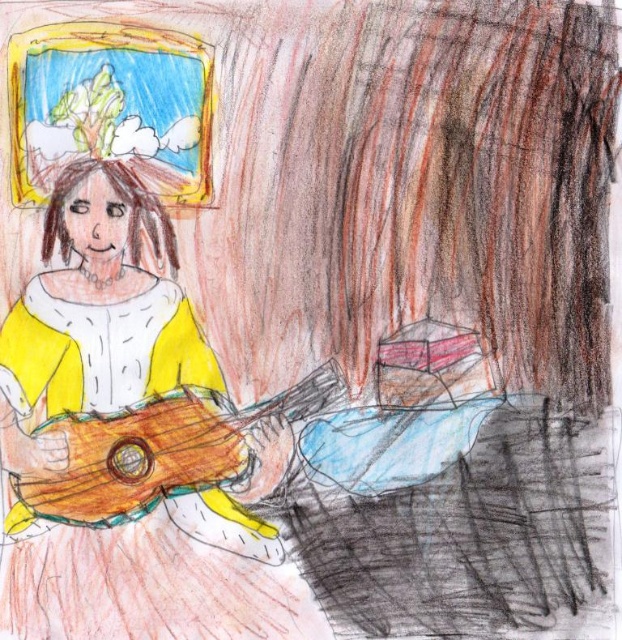
Question: Which point is farther to the camera?

Choices:
 (A) (123, 406)
 (B) (317, 371)

Answer: (B)

Question: Does matte yellow dress at left have a greater width compared to wooden guitar at lower left?

Choices:
 (A) yes
 (B) no

Answer: (B)

Question: Can you confirm if matte yellow dress at left is bigger than wooden guitar at lower left?

Choices:
 (A) no
 (B) yes

Answer: (B)

Question: Which point is closer to the camera taking this photo?

Choices:
 (A) (98, 548)
 (B) (42, 433)

Answer: (A)

Question: Does matte yellow dress at left appear on the right side of wooden guitar at lower left?

Choices:
 (A) yes
 (B) no

Answer: (B)

Question: Which point is farther to the camera?

Choices:
 (A) (183, 397)
 (B) (151, 454)

Answer: (A)